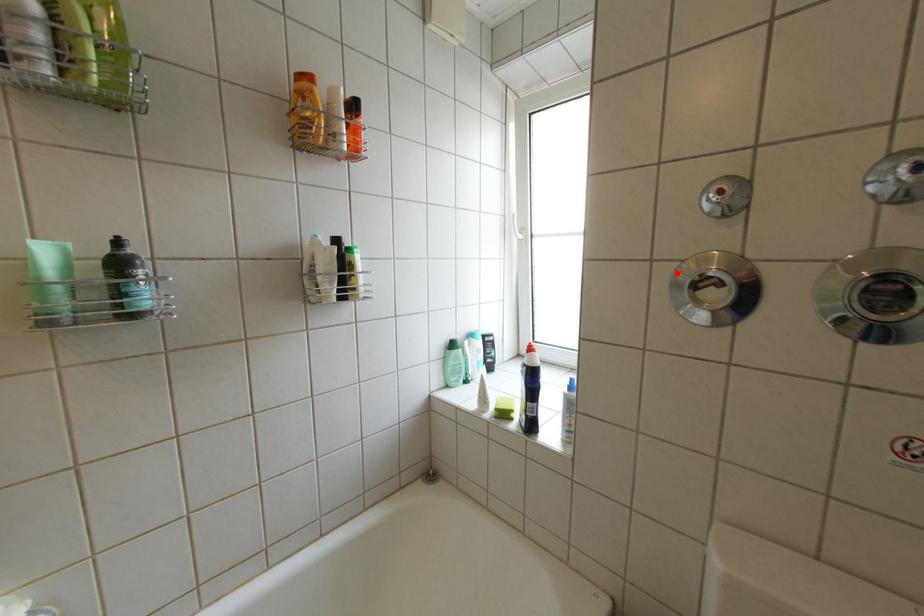
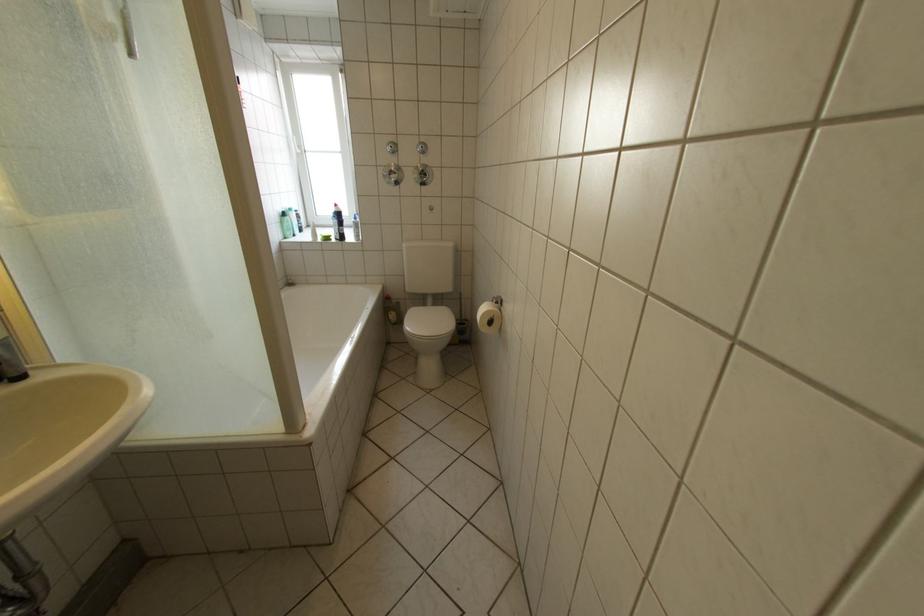
Question: I am providing you with two images of the same scene from different viewpoints. Given a red point in image1, look at the same physical point in image2. Is it:

Choices:
 (A) Closer to the viewpoint
 (B) Farther from the viewpoint

Answer: (A)